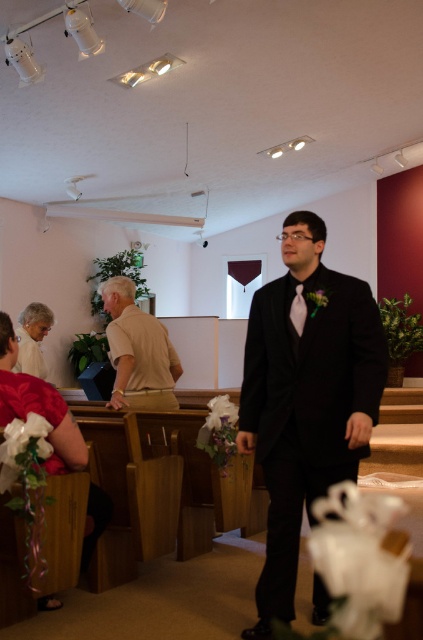
Consider the image. Does matte white dress at lower left have a lesser height compared to white satin dress at lower left?

In fact, matte white dress at lower left may be taller than white satin dress at lower left.

Is matte white dress at lower left below white satin dress at lower left?

Yes.

This screenshot has width=423, height=640. I want to click on matte white dress at lower left, so click(38, 404).

Is black satin suit at center shorter than beige cotton shirt at center?

No.

Can you confirm if black satin suit at center is positioned to the left of beige cotton shirt at center?

Incorrect, black satin suit at center is not on the left side of beige cotton shirt at center.

Is point (291, 241) less distant than point (156, 390)?

Yes, point (291, 241) is in front of point (156, 390).

Locate an element on the screen. black satin suit at center is located at coordinates (305, 397).

Is point (360, 444) behind point (294, 324)?

No, (360, 444) is closer to viewer.

Which is more to the left, black satin suit at center or white satin tie at center?

white satin tie at center is more to the left.

Between point (304, 284) and point (296, 292), which one is positioned in front?

Point (304, 284) is more forward.

The height and width of the screenshot is (640, 423). I want to click on black satin suit at center, so click(x=305, y=397).